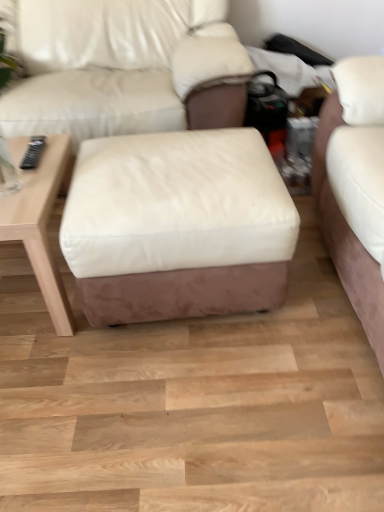
Question: Is white leather ottoman at center completely or partially outside of wooden table at left?

Choices:
 (A) yes
 (B) no

Answer: (A)

Question: Considering the relative sizes of white leather ottoman at center and wooden table at left in the image provided, is white leather ottoman at center bigger than wooden table at left?

Choices:
 (A) yes
 (B) no

Answer: (A)

Question: From the image's perspective, is white leather ottoman at center under wooden table at left?

Choices:
 (A) yes
 (B) no

Answer: (B)

Question: Does white leather ottoman at center come in front of wooden table at left?

Choices:
 (A) yes
 (B) no

Answer: (A)

Question: Does white leather ottoman at center have a lesser width compared to wooden table at left?

Choices:
 (A) yes
 (B) no

Answer: (B)

Question: Does white leather ottoman at center have a greater height compared to wooden table at left?

Choices:
 (A) no
 (B) yes

Answer: (B)

Question: Is wooden table at left thinner than matte white leather couch at center?

Choices:
 (A) no
 (B) yes

Answer: (B)

Question: Can you confirm if wooden table at left is wider than matte white leather couch at center?

Choices:
 (A) yes
 (B) no

Answer: (B)

Question: Is wooden table at left far away from matte white leather couch at center?

Choices:
 (A) no
 (B) yes

Answer: (A)

Question: From a real-world perspective, is wooden table at left physically above matte white leather couch at center?

Choices:
 (A) no
 (B) yes

Answer: (A)

Question: Is wooden table at left shorter than matte white leather couch at center?

Choices:
 (A) yes
 (B) no

Answer: (A)

Question: Does wooden table at left appear on the left side of matte white leather couch at center?

Choices:
 (A) yes
 (B) no

Answer: (A)

Question: From the image's perspective, is wooden table at left over white leather ottoman at center?

Choices:
 (A) no
 (B) yes

Answer: (A)